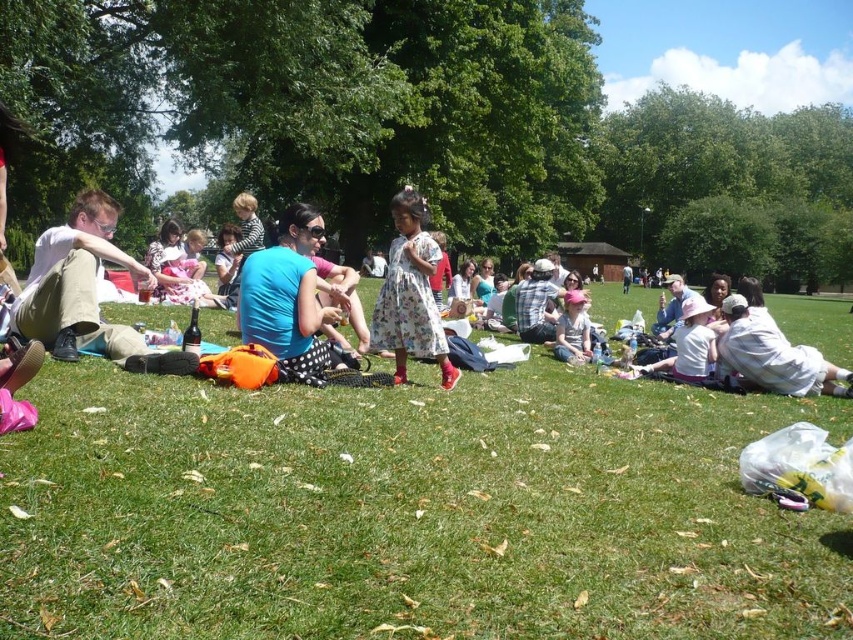
Looking at this image, is matte khaki pants at left taller than floral dress at center?

Incorrect, matte khaki pants at left's height is not larger of floral dress at center's.

Measure the distance between matte khaki pants at left and floral dress at center.

2.22 meters

Between point (73, 312) and point (409, 192), which one is positioned in front?

Point (73, 312) is more forward.

At what (x,y) coordinates should I click in order to perform the action: click on matte khaki pants at left. Please return your answer as a coordinate pair (x, y). The width and height of the screenshot is (853, 640). Looking at the image, I should click on (85, 292).

Who is positioned more to the right, floral dress at center or white cotton shirt at lower right?

white cotton shirt at lower right is more to the right.

Image resolution: width=853 pixels, height=640 pixels. I want to click on floral dress at center, so click(410, 294).

Identify the location of floral dress at center. Image resolution: width=853 pixels, height=640 pixels. (410, 294).

Who is more distant from viewer, [215,618] or [769,372]?

Positioned behind is point [769,372].

Does green grass at center have a greater width compared to white cotton shirt at lower right?

Correct, the width of green grass at center exceeds that of white cotton shirt at lower right.

Is point (635, 429) positioned behind point (776, 356)?

No, it is in front of (776, 356).

The width and height of the screenshot is (853, 640). Identify the location of green grass at center. point(408,509).